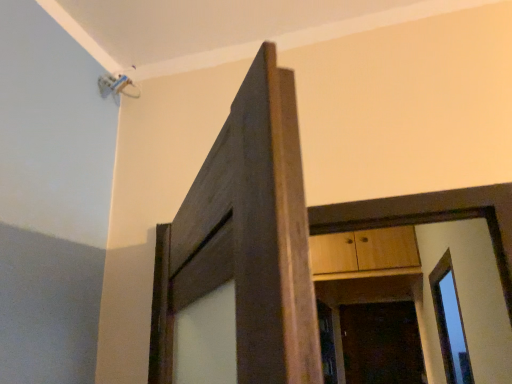
What do you see at coordinates (381, 343) in the screenshot? I see `dark wood door at center` at bounding box center [381, 343].

Where is `dark wood door at center`? dark wood door at center is located at coordinates (381, 343).

This screenshot has height=384, width=512. Find the location of `dark wood door at center`. dark wood door at center is located at coordinates (381, 343).